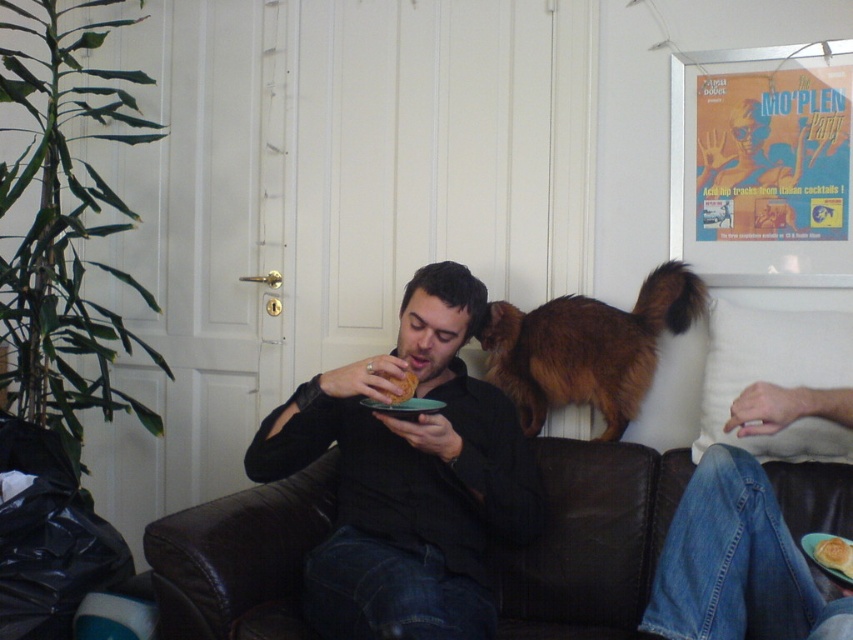
Question: Based on their relative distances, which object is farther from the bread-like at mouth?

Choices:
 (A) brown leather couch at center
 (B) golden crispy bread at lower right

Answer: (B)

Question: Which point is closer to the camera?

Choices:
 (A) (418, 412)
 (B) (519, 531)

Answer: (A)

Question: Which point is farther from the camera taking this photo?

Choices:
 (A) (403, 408)
 (B) (834, 552)
 (C) (467, 561)

Answer: (C)

Question: Can you confirm if black matte shirt at center is positioned below bread-like at mouth?

Choices:
 (A) no
 (B) yes

Answer: (B)

Question: Does golden crispy bread at lower right appear over matte black plate at lower center?

Choices:
 (A) no
 (B) yes

Answer: (A)

Question: Does black matte shirt at center appear over brown leather couch at center?

Choices:
 (A) yes
 (B) no

Answer: (A)